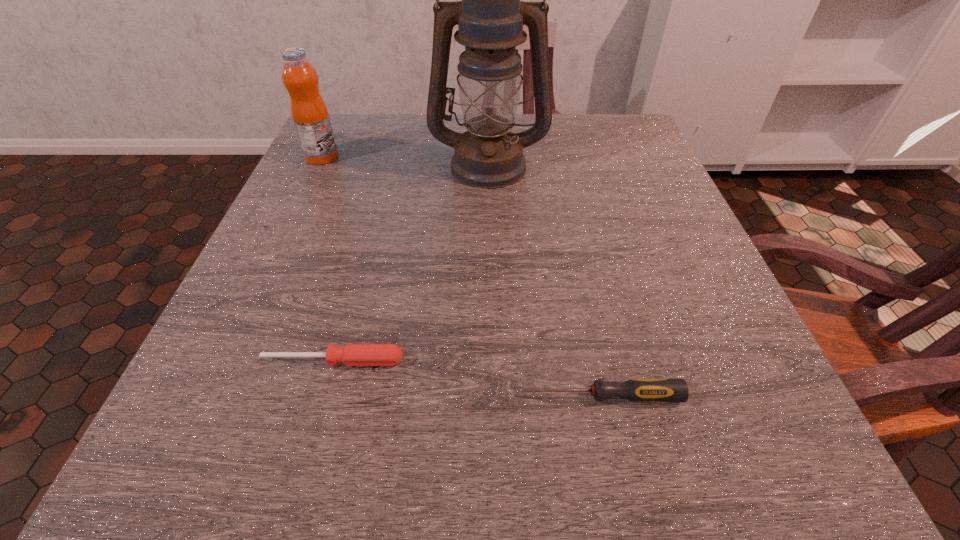
Identify the location of vacant space at the near edge of the desktop. The image size is (960, 540). (586, 497).

Where is `vacant space at the left edge`? vacant space at the left edge is located at coordinates (341, 165).

The width and height of the screenshot is (960, 540). In the image, there is a desktop. What are the coordinates of `vacant space at the right edge` in the screenshot? It's located at (736, 406).

The width and height of the screenshot is (960, 540). I want to click on free space at the far left corner of the desktop, so click(347, 128).

Locate an element on the screen. This screenshot has height=540, width=960. free spot at the near left corner of the desktop is located at coordinates (155, 492).

Locate an element on the screen. This screenshot has height=540, width=960. free space at the far right corner is located at coordinates (576, 117).

Identify the location of vacant area at the near right corner. The image size is (960, 540). (764, 447).

Identify the location of vacant space that is in between the right screwdriver and the tallest object. (543, 280).

Identify the location of free space between the oil lamp and the leftmost object. This screenshot has height=540, width=960. (405, 161).

The image size is (960, 540). In order to click on vacant region between the tallest object and the left screwdriver in this screenshot , I will do click(411, 262).